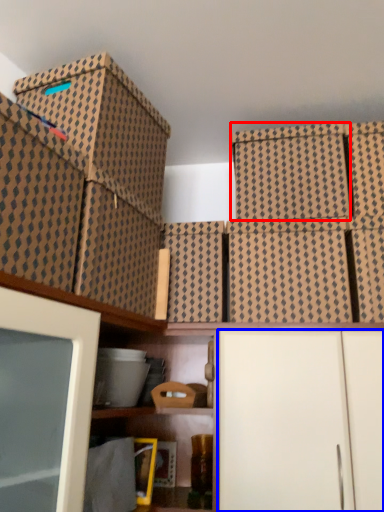
Question: Which point is closer to the camera, storage box (highlighted by a red box) or cabinetry (highlighted by a blue box)?

Choices:
 (A) storage box
 (B) cabinetry

Answer: (B)